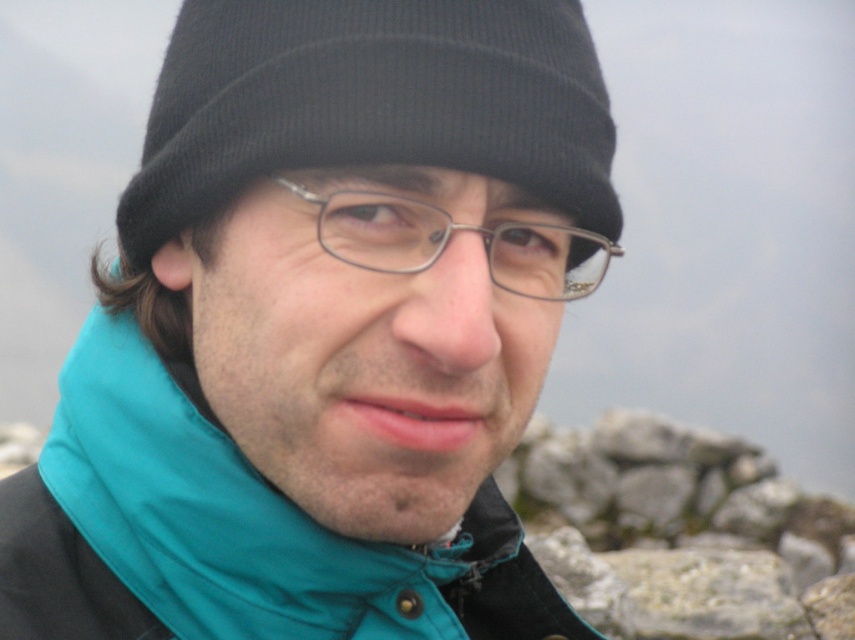
Question: Does teal fabric jacket at center come behind metallic rectangular glasses at center?

Choices:
 (A) no
 (B) yes

Answer: (A)

Question: Which of these objects is positioned closest to the teal fabric jacket at center?

Choices:
 (A) black knit hat at upper center
 (B) metallic rectangular glasses at center

Answer: (A)

Question: Which object is farther from the camera taking this photo?

Choices:
 (A) black knit hat at upper center
 (B) teal fabric jacket at center

Answer: (A)

Question: Which object appears farthest from the camera in this image?

Choices:
 (A) black knit hat at upper center
 (B) metallic rectangular glasses at center
 (C) teal fabric jacket at center

Answer: (B)

Question: Can you confirm if black knit hat at upper center is bigger than metallic rectangular glasses at center?

Choices:
 (A) yes
 (B) no

Answer: (A)

Question: Can you confirm if black knit hat at upper center is thinner than metallic rectangular glasses at center?

Choices:
 (A) no
 (B) yes

Answer: (A)